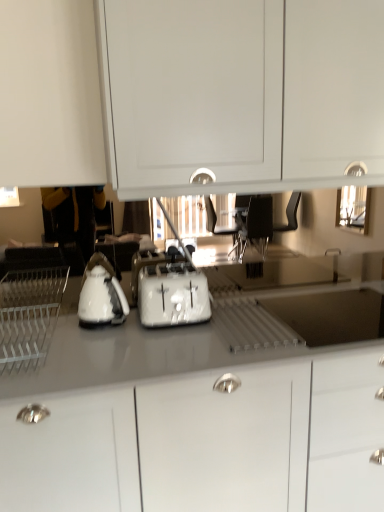
At what (x,y) coordinates should I click in order to perform the action: click on free space in front of white plastic toaster at center. Please return your answer as a coordinate pair (x, y). Looking at the image, I should click on (163, 344).